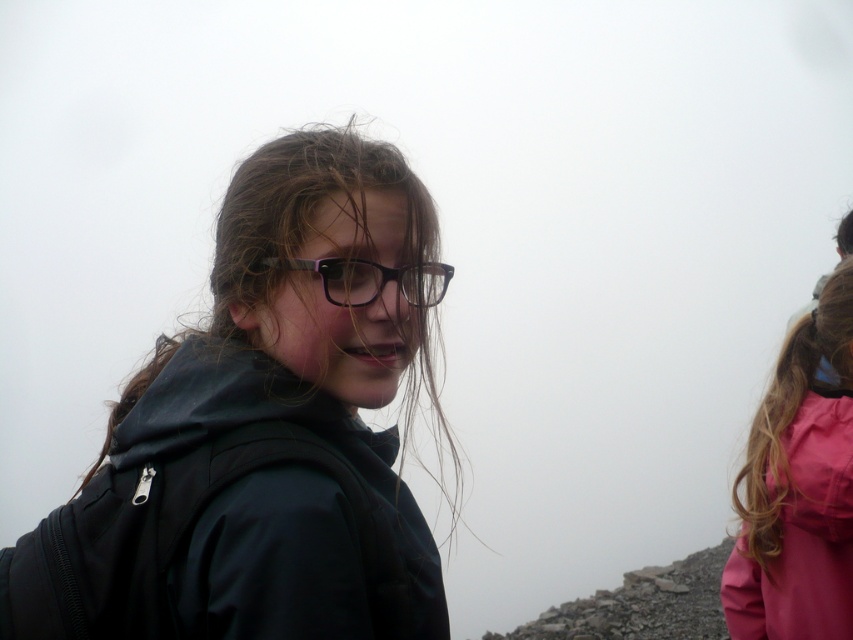
Does matte black jacket at center appear under black plastic glasses at center?

Indeed, matte black jacket at center is positioned under black plastic glasses at center.

Is matte black jacket at center thinner than black plastic glasses at center?

No, matte black jacket at center is not thinner than black plastic glasses at center.

Locate an element on the screen. The width and height of the screenshot is (853, 640). matte black jacket at center is located at coordinates (260, 435).

Is point (355, 449) closer to camera compared to point (788, 634)?

Yes.

Can you confirm if matte black jacket at center is positioned below pink matte jacket at right?

Actually, matte black jacket at center is above pink matte jacket at right.

Does point (172, 580) come closer to viewer compared to point (805, 397)?

Yes, point (172, 580) is in front of point (805, 397).

You are a GUI agent. You are given a task and a screenshot of the screen. Output one action in this format:
    pyautogui.click(x=<x>, y=<y>)
    Task: Click on the matte black jacket at center
    
    Given the screenshot: What is the action you would take?
    pyautogui.click(x=260, y=435)

What do you see at coordinates (798, 488) in the screenshot? The image size is (853, 640). I see `pink matte jacket at right` at bounding box center [798, 488].

Is pink matte jacket at right positioned in front of black plastic glasses at center?

No, pink matte jacket at right is behind black plastic glasses at center.

Locate an element on the screen. This screenshot has height=640, width=853. pink matte jacket at right is located at coordinates (798, 488).